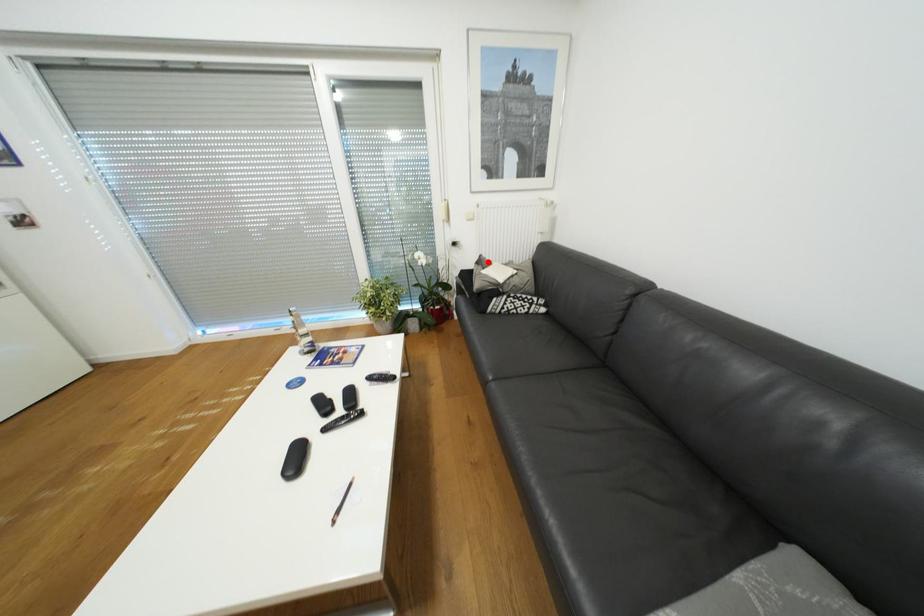
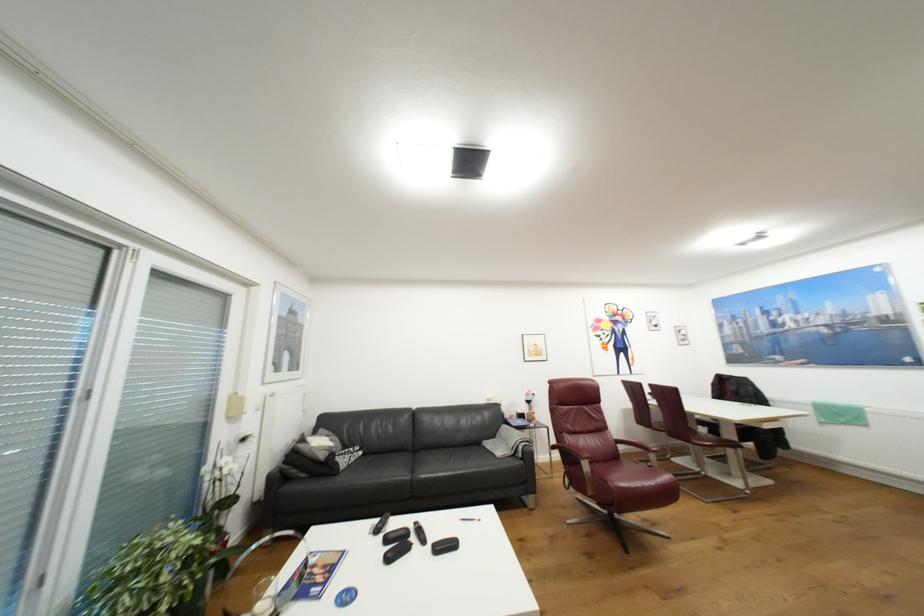
Find the pixel in the second image that matches the highlighted location in the first image.

(309, 440)